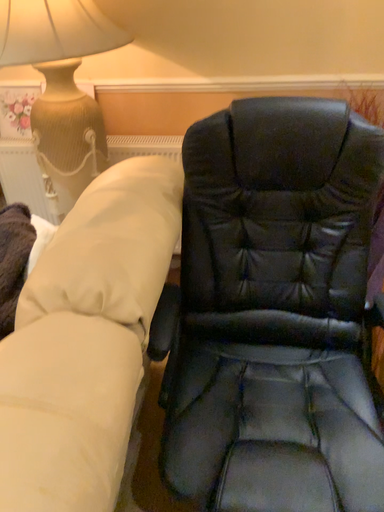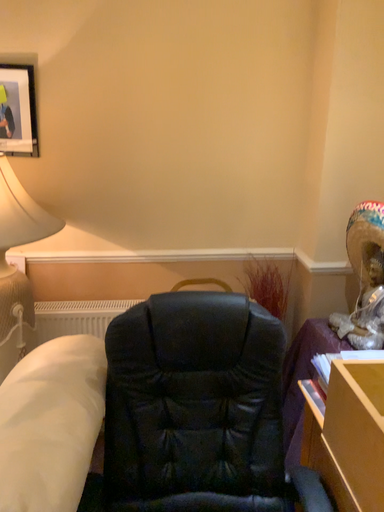
Question: Which way did the camera rotate in the video?

Choices:
 (A) rotated left
 (B) rotated right

Answer: (B)